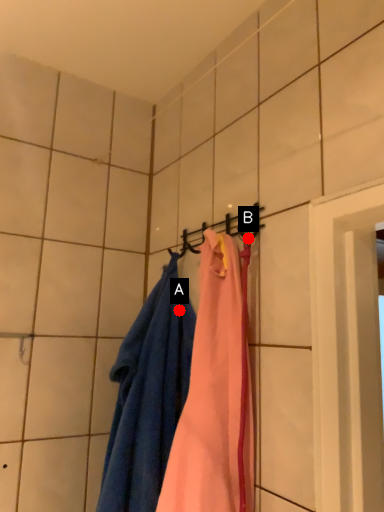
Question: Two points are circled on the image, labeled by A and B beside each circle. Which point appears farthest from the camera in this image?

Choices:
 (A) A is further
 (B) B is further

Answer: (A)